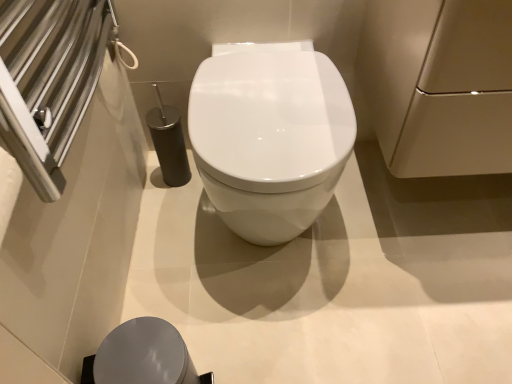
Question: In terms of width, does matte beige cabinet at upper right look wider or thinner when compared to white glossy toilet at center?

Choices:
 (A) thin
 (B) wide

Answer: (A)

Question: Is matte beige cabinet at upper right spatially inside white glossy toilet at center, or outside of it?

Choices:
 (A) inside
 (B) outside

Answer: (B)

Question: Which object is positioned farthest from the matte beige cabinet at upper right?

Choices:
 (A) matte gray lid at lower center
 (B) white glossy toilet at center

Answer: (A)

Question: Based on their relative distances, which object is farther from the matte gray lid at lower center?

Choices:
 (A) matte beige cabinet at upper right
 (B) white glossy toilet at center

Answer: (A)